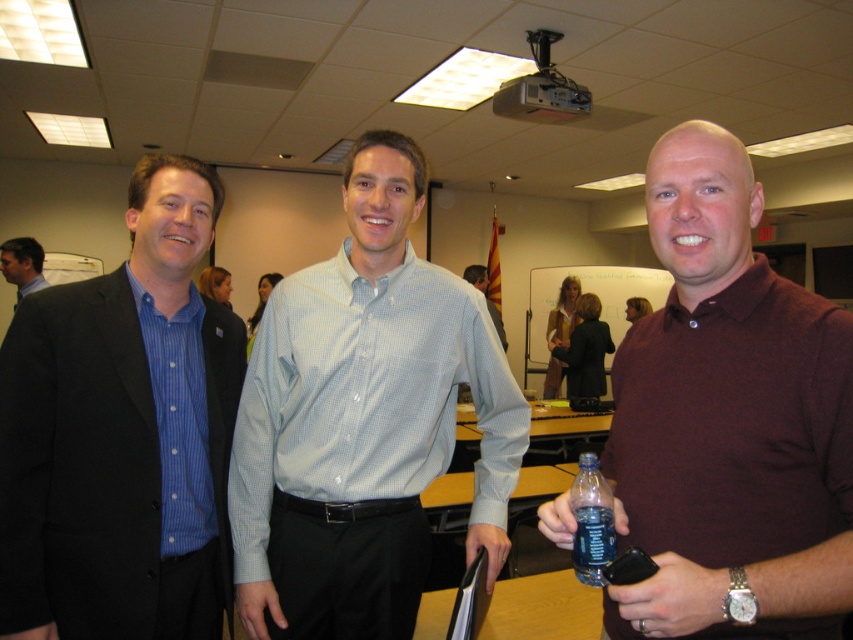
Question: Considering the real-world distances, which object is closest to the matte black suit at left?

Choices:
 (A) matte burgundy polo shirt at right
 (B) brushed metal suit at left
 (C) maroon polo shirt at right
 (D) translucent plastic bottle at center

Answer: (D)

Question: Where is maroon polo shirt at right located in relation to translucent plastic bottle at center in the image?

Choices:
 (A) above
 (B) below

Answer: (A)

Question: Can you confirm if matte black suit at left is thinner than matte burgundy polo shirt at right?

Choices:
 (A) no
 (B) yes

Answer: (A)

Question: Is brushed metal suit at left to the right of light blue shirt at center from the viewer's perspective?

Choices:
 (A) yes
 (B) no

Answer: (B)

Question: Which point is closer to the camera?

Choices:
 (A) light blue checkered shirt at center
 (B) brushed metal suit at left
 (C) light blue shirt at center

Answer: (A)

Question: Which point is farther to the camera?

Choices:
 (A) matte black suit at left
 (B) light blue shirt at center

Answer: (B)